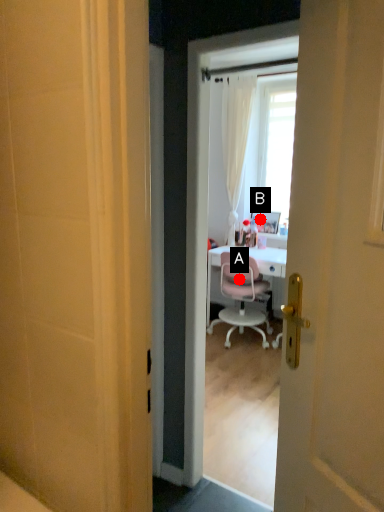
Question: Two points are circled on the image, labeled by A and B beside each circle. Which point is further to the camera?

Choices:
 (A) A is further
 (B) B is further

Answer: (B)